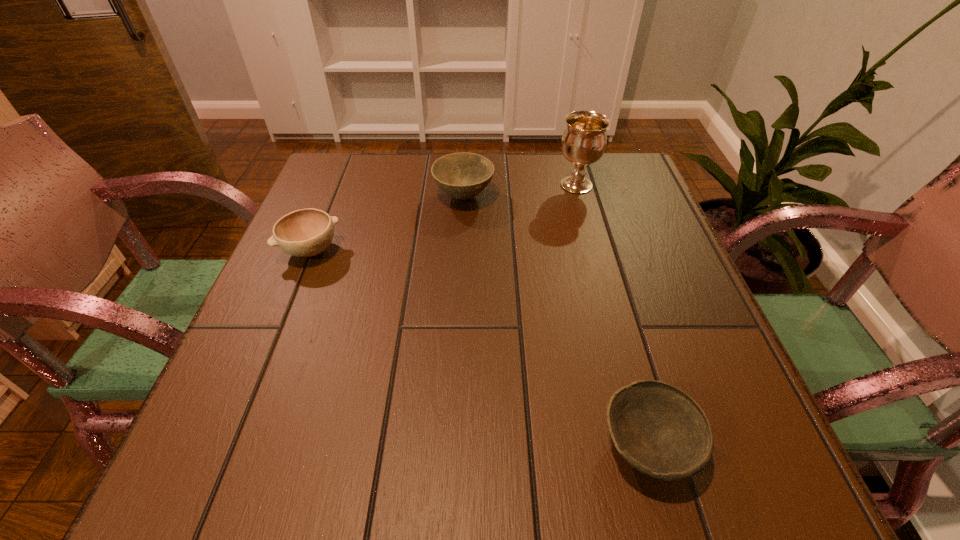
Where is `free space located 0.380m on the left of the nearest object`? free space located 0.380m on the left of the nearest object is located at coordinates (346, 446).

Find the location of a particular element. The width and height of the screenshot is (960, 540). chalice positioned at the far edge is located at coordinates (584, 140).

Identify the location of bowl located in the far edge section of the desktop. (462, 176).

You are a GUI agent. You are given a task and a screenshot of the screen. Output one action in this format:
    pyautogui.click(x=<x>, y=<y>)
    Task: Click on the object at the near edge
    The height and width of the screenshot is (540, 960).
    Given the screenshot: What is the action you would take?
    pyautogui.click(x=661, y=431)

Identify the location of object located at the left edge. click(308, 232).

This screenshot has width=960, height=540. In order to click on chalice positioned at the right edge in this screenshot , I will do (x=584, y=140).

Where is `bowl situated at the right edge`? bowl situated at the right edge is located at coordinates (661, 431).

In order to click on object at the far right corner in this screenshot , I will do `click(584, 140)`.

You are a GUI agent. You are given a task and a screenshot of the screen. Output one action in this format:
    pyautogui.click(x=<x>, y=<y>)
    Task: Click on the object situated at the near right corner
    This screenshot has height=540, width=960.
    Given the screenshot: What is the action you would take?
    pyautogui.click(x=661, y=431)

Where is `free space at the far edge`? This screenshot has width=960, height=540. free space at the far edge is located at coordinates (517, 166).